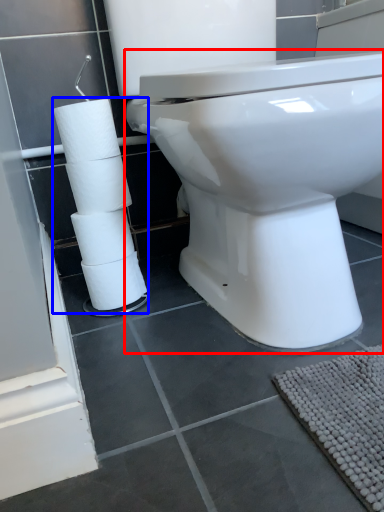
Question: Which object appears closest to the camera in this image, toilet (highlighted by a red box) or toilet paper (highlighted by a blue box)?

Choices:
 (A) toilet
 (B) toilet paper

Answer: (A)